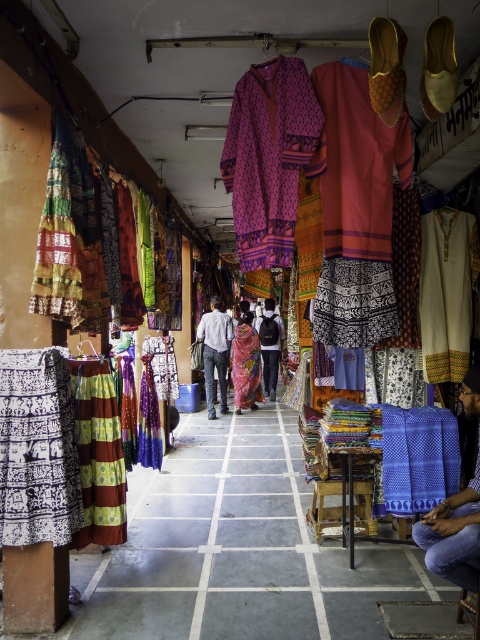
Question: Which object is the farthest from the denim jeans at center?

Choices:
 (A) blue woven fabric at lower right
 (B) textured multicolored fabric at left
 (C) matte pink fabric at center

Answer: (A)

Question: Which is farther from the denim jeans at center?

Choices:
 (A) blue woven fabric at lower right
 (B) floral silk scarf at center
 (C) textured multicolored fabric at left

Answer: (A)

Question: Is textured multicolored fabric at left below matte pink fabric at center?

Choices:
 (A) yes
 (B) no

Answer: (B)

Question: Considering the relative positions of denim jeans at center and matte pink fabric at center in the image provided, where is denim jeans at center located with respect to matte pink fabric at center?

Choices:
 (A) left
 (B) right

Answer: (A)

Question: Which object is the farthest from the denim jeans at center?

Choices:
 (A) textured multicolored fabric at left
 (B) floral silk scarf at center
 (C) matte pink fabric at center
 (D) blue woven fabric at lower right

Answer: (D)

Question: Can you confirm if blue woven fabric at lower right is bigger than floral silk scarf at center?

Choices:
 (A) no
 (B) yes

Answer: (A)